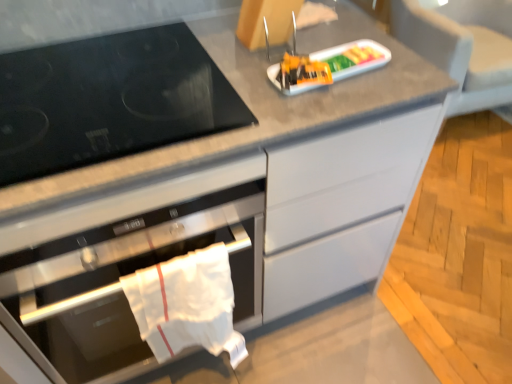
Identify the location of free spot above black glass gas stove at left (from a real-world perspective). (121, 85).